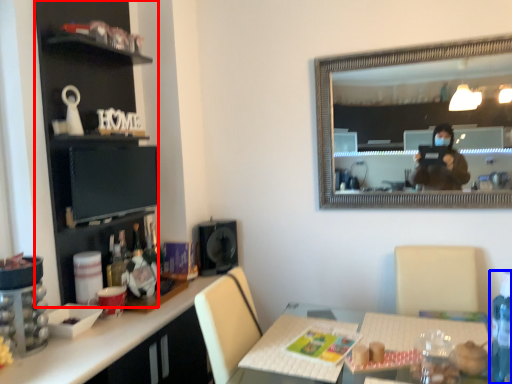
Question: Which of the following is the farthest to the observer, cabinetry (highlighted by a red box) or bottle (highlighted by a blue box)?

Choices:
 (A) cabinetry
 (B) bottle

Answer: (A)